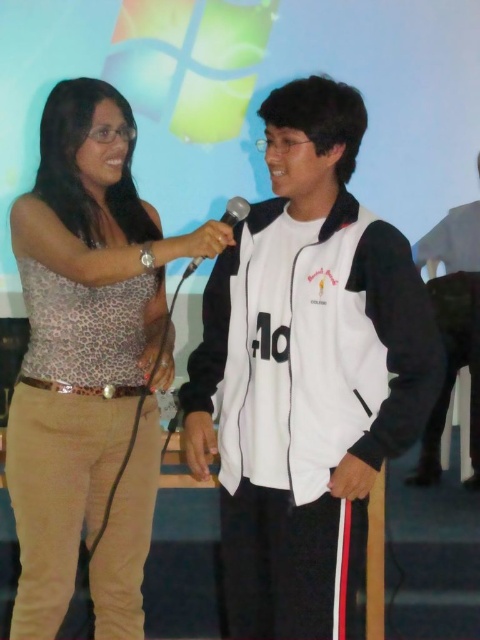
You are a stagehand setting up for a live event. You need to place a new stand for the black metallic microphone at center so it doesn not block the white matte jacket at center. Based on the current setup, will the microphone stand need to be placed to the left or right of the jacket?

The white matte jacket at center might be wider than black metallic microphone at center, so to avoid blocking it, the microphone stand should be placed to the left of the white matte jacket at center.

You are a photographer positioned behind the leopard print tank top at left and the black metallic microphone at center. You want to take a photo of the person on the right without any obstruction. Which object should you move out of the way?

The black metallic microphone at center is behind the leopard print tank top at left, so you should move the leopard print tank top at left to avoid blocking the view of the person on the right.

You are a photographer positioned at the center of the stage. You want to take a closeup shot of the leopard print tank top at left. What direction should you move to get closer to it?

Since the leopard print tank top at left is located at point 0.523 on the x axis and 0.169 on the y axis, you should move to the left to get closer to it.